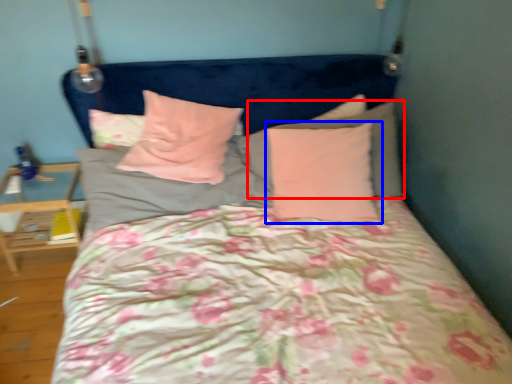
Question: Among these objects, which one is nearest to the camera, pillow (highlighted by a red box) or pillow (highlighted by a blue box)?

Choices:
 (A) pillow
 (B) pillow

Answer: (B)